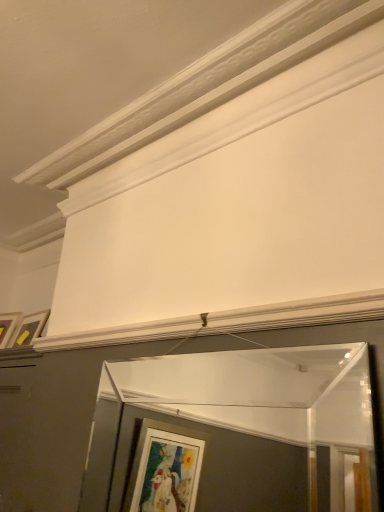
Question: Considering the relative positions of clear glass mirror at center and matte white picture frame at upper left in the image provided, is clear glass mirror at center in front of matte white picture frame at upper left?

Choices:
 (A) yes
 (B) no

Answer: (A)

Question: Is clear glass mirror at center surrounding matte white picture frame at upper left?

Choices:
 (A) yes
 (B) no

Answer: (B)

Question: Can you confirm if clear glass mirror at center is bigger than matte white picture frame at upper left?

Choices:
 (A) no
 (B) yes

Answer: (B)

Question: Can you confirm if clear glass mirror at center is thinner than matte white picture frame at upper left?

Choices:
 (A) yes
 (B) no

Answer: (A)

Question: Does clear glass mirror at center have a greater width compared to matte white picture frame at upper left?

Choices:
 (A) yes
 (B) no

Answer: (B)

Question: Is clear glass mirror at center taller than matte white picture frame at upper left?

Choices:
 (A) no
 (B) yes

Answer: (B)

Question: Is matte white picture frame at upper left in contact with clear glass mirror at center?

Choices:
 (A) no
 (B) yes

Answer: (A)

Question: Is there a large distance between matte white picture frame at upper left and clear glass mirror at center?

Choices:
 (A) no
 (B) yes

Answer: (B)

Question: From a real-world perspective, is matte white picture frame at upper left physically above clear glass mirror at center?

Choices:
 (A) yes
 (B) no

Answer: (A)

Question: Is clear glass mirror at center completely or partially inside matte white picture frame at upper left?

Choices:
 (A) no
 (B) yes

Answer: (A)

Question: From the image's perspective, is matte white picture frame at upper left located beneath clear glass mirror at center?

Choices:
 (A) yes
 (B) no

Answer: (B)

Question: Considering the relative sizes of matte white picture frame at upper left and clear glass mirror at center in the image provided, is matte white picture frame at upper left bigger than clear glass mirror at center?

Choices:
 (A) yes
 (B) no

Answer: (B)

Question: Considering the positions of clear glass mirror at center and matte white picture frame at upper left in the image, is clear glass mirror at center taller or shorter than matte white picture frame at upper left?

Choices:
 (A) tall
 (B) short

Answer: (A)